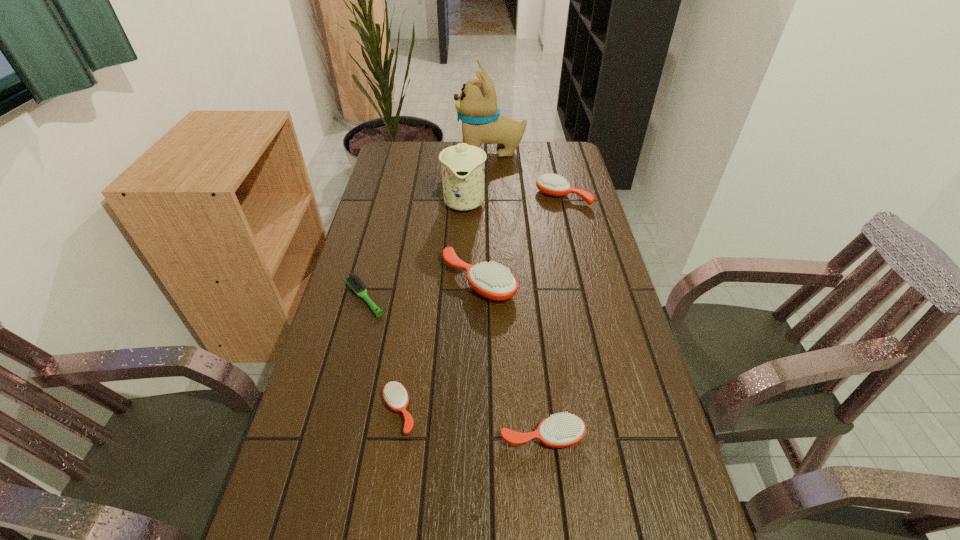
What are the coordinates of `blank space located on the back of the sixth object from right to left` in the screenshot? It's located at (412, 325).

I want to click on free space located on the back of the shortest hairbrush, so click(x=378, y=242).

The image size is (960, 540). Identify the location of object that is at the far edge. click(x=476, y=106).

At what (x,y) coordinates should I click in order to perform the action: click on object located at the left edge. Please return your answer as a coordinate pair (x, y). The height and width of the screenshot is (540, 960). Looking at the image, I should click on (353, 281).

You are a GUI agent. You are given a task and a screenshot of the screen. Output one action in this format:
    pyautogui.click(x=<x>, y=<y>)
    Task: Click on the object present at the right edge
    
    Given the screenshot: What is the action you would take?
    pyautogui.click(x=551, y=184)

The width and height of the screenshot is (960, 540). I want to click on free space at the far edge of the desktop, so click(526, 156).

Find the location of a particular element. Image resolution: width=960 pixels, height=540 pixels. vacant point at the left edge is located at coordinates (358, 369).

Image resolution: width=960 pixels, height=540 pixels. I want to click on free space at the right edge of the desktop, so click(615, 295).

Locate an element on the screen. unoccupied area between the tallest object and the smallest orange hairbrush is located at coordinates (444, 281).

Locate an element on the screen. free point between the tallest hairbrush and the chinaware is located at coordinates tap(471, 241).